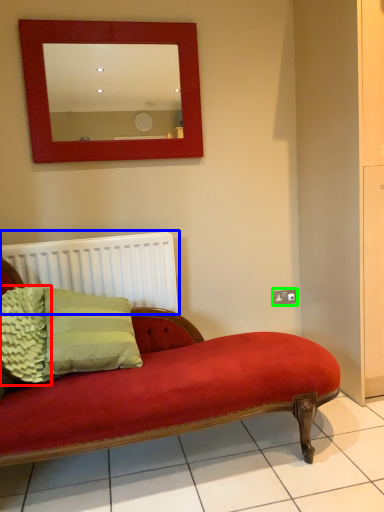
Question: Which is farther away from pillow (highlighted by a red box)? radiator (highlighted by a blue box) or electric outlet (highlighted by a green box)?

Choices:
 (A) radiator
 (B) electric outlet

Answer: (B)